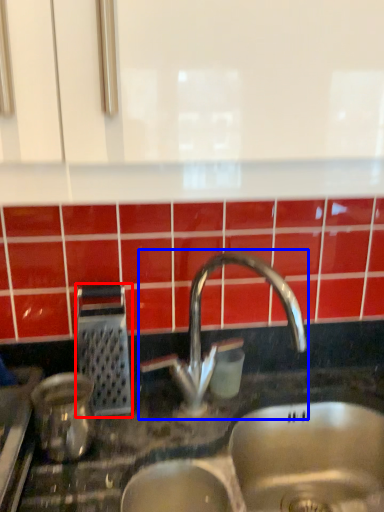
Question: Among these objects, which one is farthest to the camera, appliance (highlighted by a red box) or tap (highlighted by a blue box)?

Choices:
 (A) appliance
 (B) tap

Answer: (A)